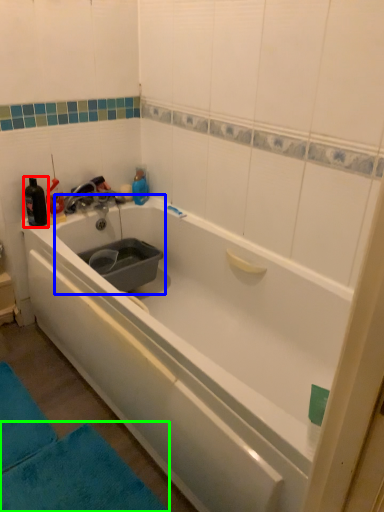
Question: Which object is the closest to the bottle (highlighted by a red box)? Choose among these: sink (highlighted by a blue box) or bath mat (highlighted by a green box).

Choices:
 (A) sink
 (B) bath mat

Answer: (A)